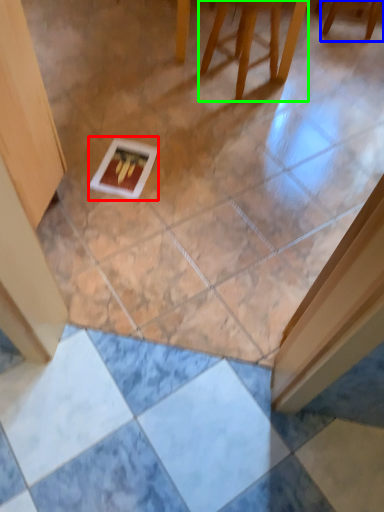
Question: Which is nearer to the postcard (highlighted by a red box)? furniture (highlighted by a blue box) or furniture (highlighted by a green box).

Choices:
 (A) furniture
 (B) furniture

Answer: (B)